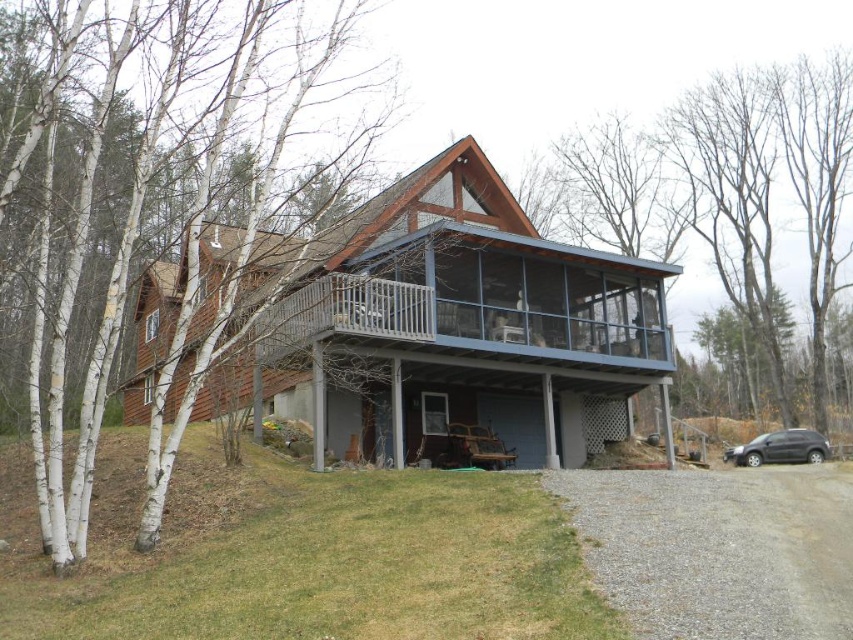
Question: Does white bark tree at left come behind satin black suv at lower right?

Choices:
 (A) yes
 (B) no

Answer: (B)

Question: Among these points, which one is nearest to the camera?

Choices:
 (A) (782, 445)
 (B) (654, 371)

Answer: (B)

Question: Is brown wood tree at upper center wider than gravel at lower right?

Choices:
 (A) yes
 (B) no

Answer: (A)

Question: Which object is the closest to the gravel at lower right?

Choices:
 (A) satin black suv at lower right
 (B) blue glass porch at upper center
 (C) brown wood tree at upper center

Answer: (B)

Question: Does brown wood tree at upper center appear on the right side of satin black suv at lower right?

Choices:
 (A) yes
 (B) no

Answer: (A)

Question: Which is nearer to the brown wood cabin at center?

Choices:
 (A) white bark tree at left
 (B) gravel at lower right
 (C) satin black suv at lower right
 (D) blue glass porch at upper center

Answer: (D)